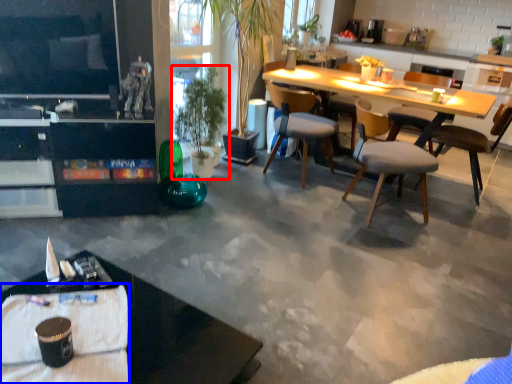
Question: Which object is closer to the camera taking this photo, houseplant (highlighted by a red box) or tablecloth (highlighted by a blue box)?

Choices:
 (A) houseplant
 (B) tablecloth

Answer: (B)